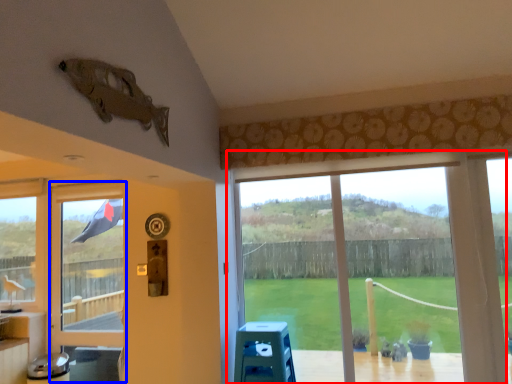
Question: Which object appears farthest to the camera in this image, window (highlighted by a red box) or screen door (highlighted by a blue box)?

Choices:
 (A) window
 (B) screen door

Answer: (B)